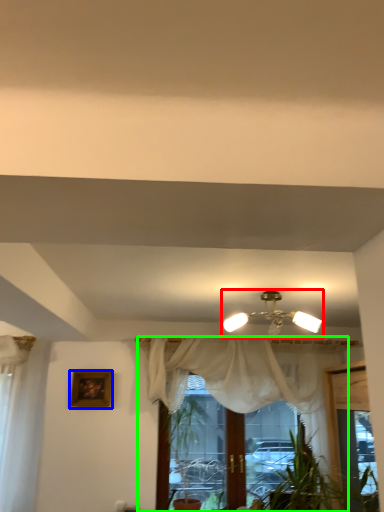
Question: Based on their relative distances, which object is farther from lamp (highlighted by a red box)? Choose from picture frame (highlighted by a blue box) and curtain (highlighted by a green box).

Choices:
 (A) picture frame
 (B) curtain

Answer: (A)